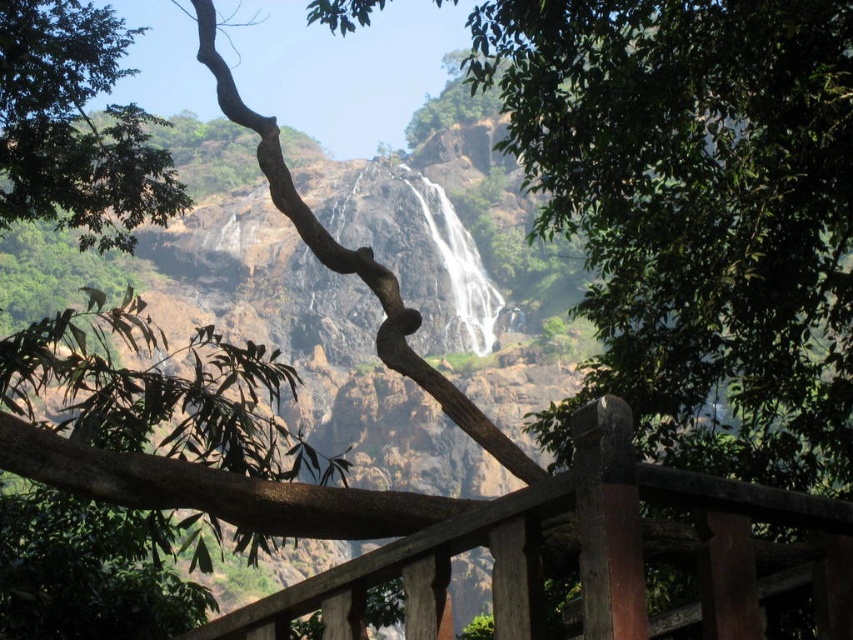
Question: Can you confirm if brown wooden fence at center is smaller than green leafy tree at upper left?

Choices:
 (A) no
 (B) yes

Answer: (B)

Question: Can you confirm if brown wooden fence at center is wider than green leafy tree at upper left?

Choices:
 (A) no
 (B) yes

Answer: (A)

Question: Can you confirm if brown wooden fence at center is positioned above green leafy tree at upper left?

Choices:
 (A) yes
 (B) no

Answer: (B)

Question: Which object is farther from the camera taking this photo?

Choices:
 (A) green leafy tree at upper left
 (B) brown wooden fence at center

Answer: (A)